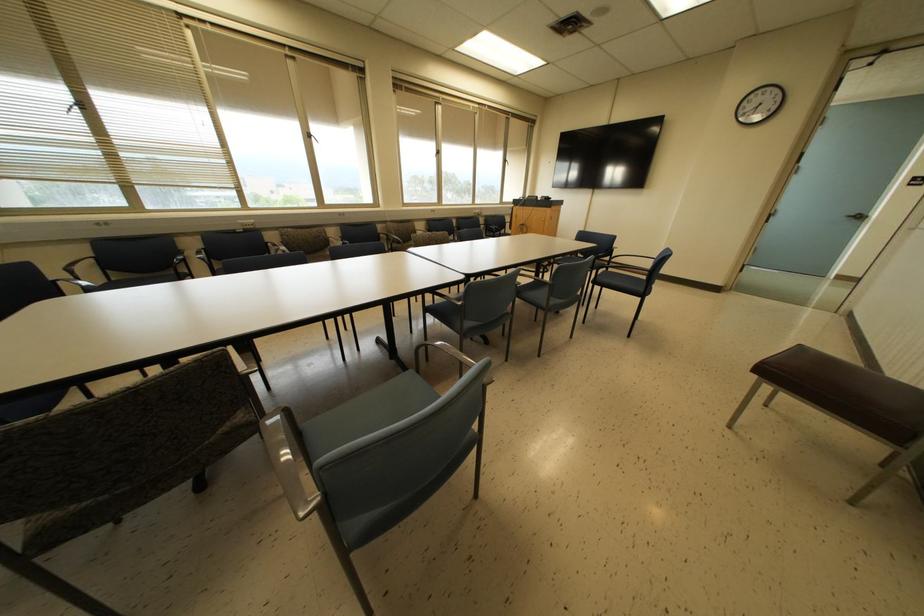
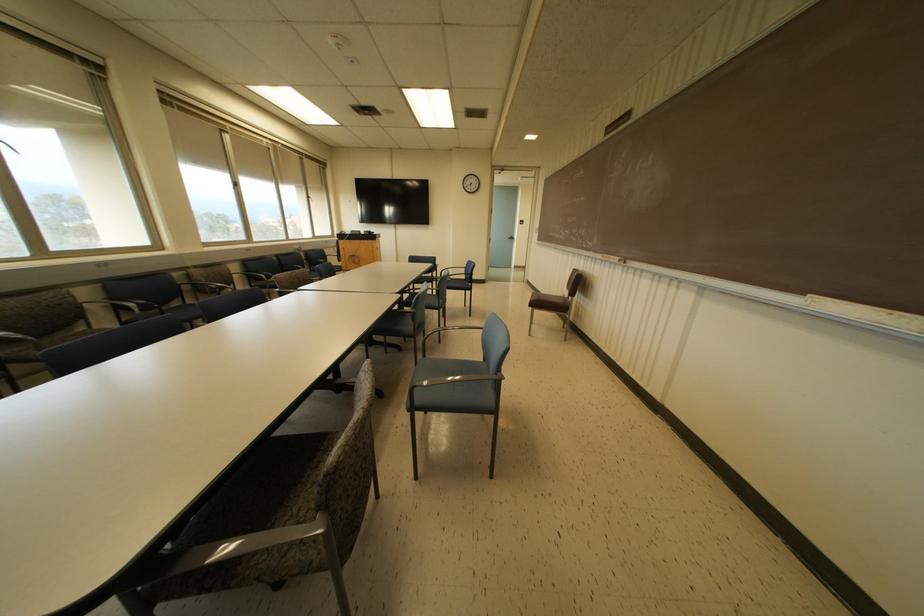
Where in the second image is the point corresponding to point (609, 262) from the first image?

(438, 274)